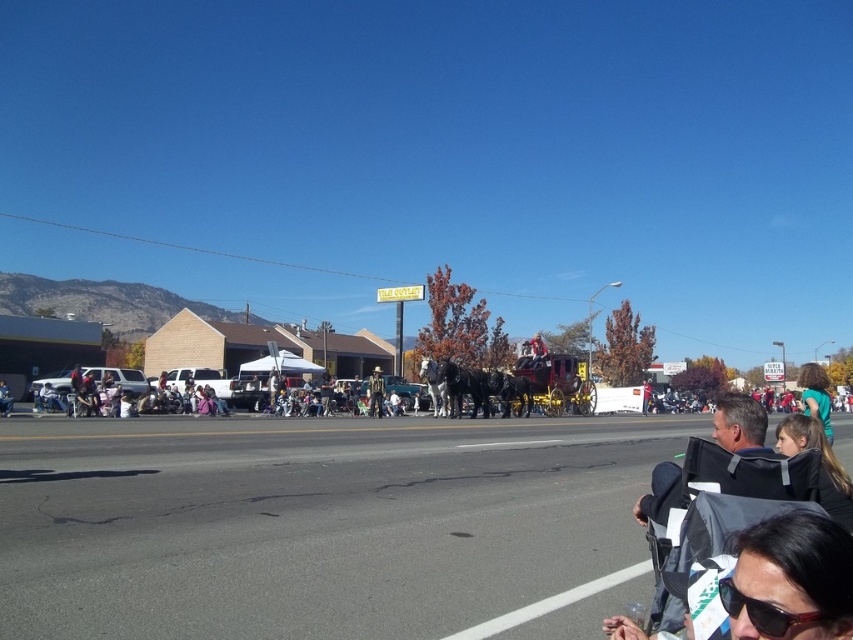
Question: Which point is farther from the camera taking this photo?

Choices:
 (A) (817, 400)
 (B) (378, 376)

Answer: (B)

Question: Does black plastic bag at lower right have a smaller size compared to wooden cowboy hat at center?

Choices:
 (A) no
 (B) yes

Answer: (B)

Question: Which object is the closest to the black plastic bag at lower right?

Choices:
 (A) green matte shirt at center
 (B) wooden cowboy hat at center

Answer: (A)

Question: Is green matte shirt at center thinner than wooden cowboy hat at center?

Choices:
 (A) yes
 (B) no

Answer: (B)

Question: Considering the real-world distances, which object is closest to the wooden cowboy hat at center?

Choices:
 (A) black plastic bag at lower right
 (B) green matte shirt at center

Answer: (B)

Question: Where is black plastic bag at lower right located in relation to wooden cowboy hat at center in the image?

Choices:
 (A) left
 (B) right

Answer: (B)